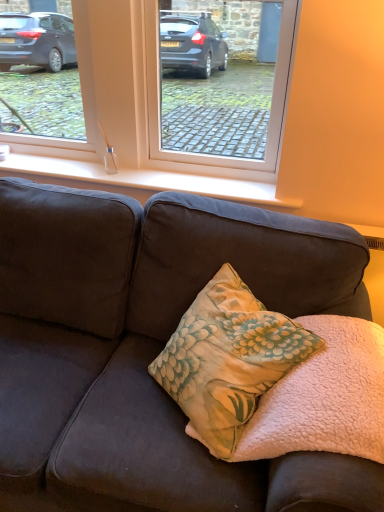
Question: Considering their positions, is floral fabric pillow at center located in front of or behind matte glass window at upper center?

Choices:
 (A) front
 (B) behind

Answer: (A)

Question: In terms of height, does floral fabric pillow at center look taller or shorter compared to matte glass window at upper center?

Choices:
 (A) tall
 (B) short

Answer: (B)

Question: Which object is the farthest from the white glossy glass at center?

Choices:
 (A) floral fabric pillow at center
 (B) matte glass window at upper center
 (C) fluffy pink blanket at center

Answer: (C)

Question: Based on their relative distances, which object is nearer to the fluffy pink blanket at center?

Choices:
 (A) matte glass window at upper center
 (B) white glossy glass at center
 (C) floral fabric pillow at center

Answer: (C)